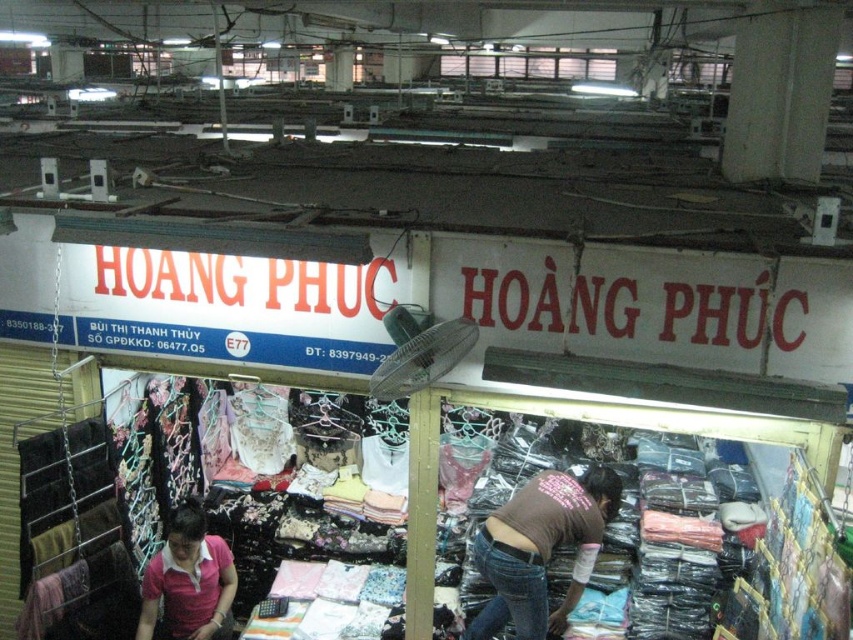
Is point (514, 497) positioned before point (148, 572)?

No, it is behind (148, 572).

Where is `denim jeans at center`? The height and width of the screenshot is (640, 853). denim jeans at center is located at coordinates (540, 548).

Who is more forward, (532, 488) or (180, 586)?

Point (180, 586) is in front.

The width and height of the screenshot is (853, 640). What are the coordinates of `denim jeans at center` in the screenshot? It's located at (540, 548).